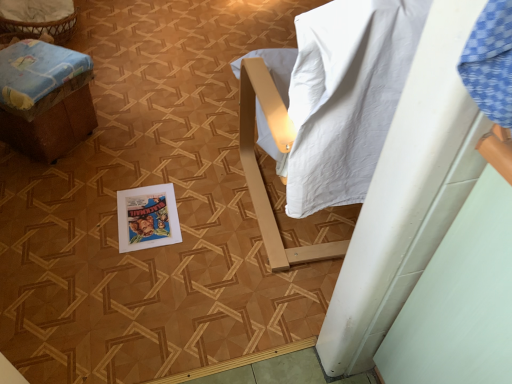
You are a GUI agent. You are given a task and a screenshot of the screen. Output one action in this format:
    pyautogui.click(x=<x>, y=<y>)
    Task: Click on the vacant area that is situated to the right of brown cardboard box at left
    This screenshot has height=384, width=512.
    Given the screenshot: What is the action you would take?
    pyautogui.click(x=147, y=148)